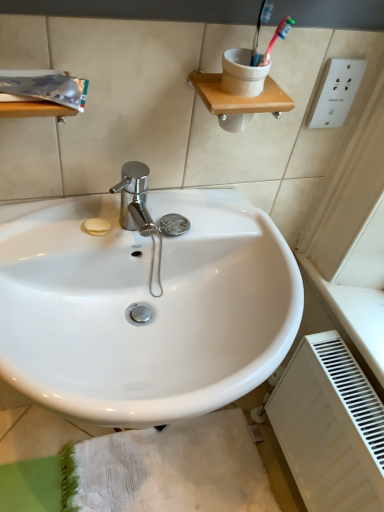
Measure the distance between white glossy sink at center and camera.

22.42 inches.

Describe the element at coordinates (330, 426) in the screenshot. I see `white matte radiator at lower right` at that location.

Find the location of a particular element. This screenshot has width=384, height=512. white glossy sink at center is located at coordinates (147, 303).

Which of these two, white textured bath mat at lower center or white glossy sink at center, is bigger?

white glossy sink at center is bigger.

Is white textured bath mat at lower center thinner than white glossy sink at center?

No, white textured bath mat at lower center is not thinner than white glossy sink at center.

Considering the positions of objects white textured bath mat at lower center and white glossy sink at center in the image provided, who is more to the right, white textured bath mat at lower center or white glossy sink at center?

From the viewer's perspective, white textured bath mat at lower center appears more on the right side.

From the image's perspective, is white textured bath mat at lower center above white glossy sink at center?

Incorrect, from the image's perspective, white textured bath mat at lower center is lower than white glossy sink at center.

Based on their sizes in the image, would you say white matte radiator at lower right is bigger or smaller than white plastic electric outlet at upper right?

Clearly, white matte radiator at lower right is larger in size than white plastic electric outlet at upper right.

Is white matte radiator at lower right aimed at white plastic electric outlet at upper right?

No, white matte radiator at lower right is not aimed at white plastic electric outlet at upper right.

Is point (268, 413) less distant than point (343, 88)?

No, it is not.

From a real-world perspective, is white matte radiator at lower right located higher than white plastic electric outlet at upper right?

No, from a real-world perspective, white matte radiator at lower right is not above white plastic electric outlet at upper right.

Which is closer, (x=327, y=101) or (x=169, y=277)?

The point (x=327, y=101) is in front.

Considering the sizes of white plastic electric outlet at upper right and white glossy sink at center in the image, is white plastic electric outlet at upper right taller or shorter than white glossy sink at center?

Considering their sizes, white plastic electric outlet at upper right has less height than white glossy sink at center.

How different are the orientations of white plastic electric outlet at upper right and white glossy sink at center in degrees?

white plastic electric outlet at upper right and white glossy sink at center are facing 0.96 degrees away from each other.

From a real-world perspective, which is physically below, white matte radiator at lower right or white glossy sink at center?

white matte radiator at lower right is physically lower.

How far apart are white matte radiator at lower right and white glossy sink at center?

white matte radiator at lower right and white glossy sink at center are 18.23 inches apart from each other.

Locate an element on the screen. The image size is (384, 512). radiator below the white glossy sink at center (from a real-world perspective) is located at coordinates click(x=330, y=426).

Considering the relative sizes of white matte radiator at lower right and white glossy sink at center in the image provided, is white matte radiator at lower right bigger than white glossy sink at center?

Actually, white matte radiator at lower right might be smaller than white glossy sink at center.

Measure the distance from white glossy sink at center to white textured bath mat at lower center.

They are 29.26 inches apart.

Which is behind, point (24, 236) or point (94, 478)?

The point (94, 478) is behind.

Is white glossy sink at center situated inside white textured bath mat at lower center or outside?

white glossy sink at center is outside white textured bath mat at lower center.

Between white glossy sink at center and white textured bath mat at lower center, which one has larger width?

Wider between the two is white textured bath mat at lower center.

Between white matte radiator at lower right and white textured bath mat at lower center, which one has larger size?

white matte radiator at lower right.

How different are the orientations of white matte radiator at lower right and white textured bath mat at lower center in degrees?

The angular difference between white matte radiator at lower right and white textured bath mat at lower center is 0.305 degrees.

Considering their positions, is white matte radiator at lower right located in front of or behind white textured bath mat at lower center?

Clearly, white matte radiator at lower right is in front of white textured bath mat at lower center.

Which of these two, white glossy sink at center or white matte radiator at lower right, is wider?

white glossy sink at center is wider.

Based on their positions, is white glossy sink at center located to the left or right of white matte radiator at lower right?

Clearly, white glossy sink at center is on the left of white matte radiator at lower right in the image.

Between white glossy sink at center and white matte radiator at lower right, which one has smaller size?

With smaller size is white matte radiator at lower right.

Looking at this image, from the image's perspective, is white glossy sink at center on top of white matte radiator at lower right?

Yes.

You are a GUI agent. You are given a task and a screenshot of the screen. Output one action in this format:
    pyautogui.click(x=<x>, y=<y>)
    Task: Click on the bath mat located on the right of white glossy sink at center
    
    Given the screenshot: What is the action you would take?
    pyautogui.click(x=169, y=469)

Locate an element on the screen. This screenshot has width=384, height=512. radiator below the white plastic electric outlet at upper right (from the image's perspective) is located at coordinates point(330,426).

When comparing their distances from white textured bath mat at lower center, does white matte radiator at lower right or white glossy sink at center seem closer?

white matte radiator at lower right is positioned closer to the anchor white textured bath mat at lower center.

Looking at the image, which one is located further to white glossy sink at center, white textured bath mat at lower center or white plastic electric outlet at upper right?

The object further to white glossy sink at center is white textured bath mat at lower center.

Considering their positions, is white glossy sink at center positioned closer to white plastic electric outlet at upper right than white textured bath mat at lower center?

white glossy sink at center.

Based on their spatial positions, is white glossy sink at center or white matte radiator at lower right further from white textured bath mat at lower center?

white glossy sink at center.

From the image, which object appears to be nearer to white plastic electric outlet at upper right, white matte radiator at lower right or white glossy sink at center?

The object closer to white plastic electric outlet at upper right is white glossy sink at center.

Estimate the real-world distances between objects in this image. Which object is closer to white plastic electric outlet at upper right, white matte radiator at lower right or white textured bath mat at lower center?

white matte radiator at lower right lies closer to white plastic electric outlet at upper right than the other object.

Looking at the image, which one is located further to white matte radiator at lower right, white textured bath mat at lower center or white plastic electric outlet at upper right?

Based on the image, white plastic electric outlet at upper right appears to be further to white matte radiator at lower right.

Looking at the image, which one is located further to white textured bath mat at lower center, white plastic electric outlet at upper right or white glossy sink at center?

Based on the image, white plastic electric outlet at upper right appears to be further to white textured bath mat at lower center.

Where is `radiator between white glossy sink at center and white textured bath mat at lower center from front to back`? The height and width of the screenshot is (512, 384). radiator between white glossy sink at center and white textured bath mat at lower center from front to back is located at coordinates (330, 426).

I want to click on sink between white plastic electric outlet at upper right and white matte radiator at lower right in the up-down direction, so click(x=147, y=303).

Where is `sink that lies between white plastic electric outlet at upper right and white textured bath mat at lower center from top to bottom`? The height and width of the screenshot is (512, 384). sink that lies between white plastic electric outlet at upper right and white textured bath mat at lower center from top to bottom is located at coordinates (147, 303).

Identify the location of radiator between white plastic electric outlet at upper right and white textured bath mat at lower center vertically. (330, 426).